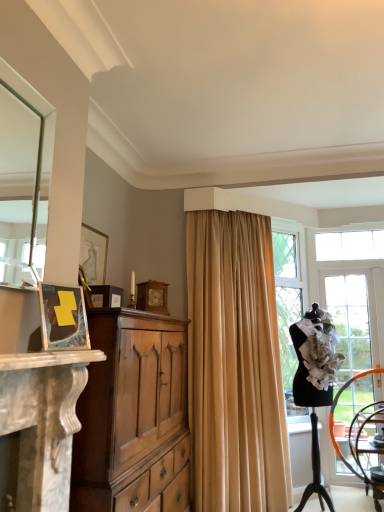
Question: Is black mannequin at right to the left of matte brown picture frame at center-left, the 2th picture frame from the front, from the viewer's perspective?

Choices:
 (A) yes
 (B) no

Answer: (B)

Question: From a real-world perspective, is black mannequin at right under matte brown picture frame at center-left, which is the third picture frame in back-to-front order?

Choices:
 (A) no
 (B) yes

Answer: (B)

Question: Is black mannequin at right far from matte brown picture frame at center-left, which is the third picture frame in back-to-front order?

Choices:
 (A) yes
 (B) no

Answer: (A)

Question: Does black mannequin at right appear on the right side of matte brown picture frame at center-left, the 2th picture frame from the front?

Choices:
 (A) yes
 (B) no

Answer: (A)

Question: Does black mannequin at right have a greater height compared to matte brown picture frame at center-left, which is the third picture frame in back-to-front order?

Choices:
 (A) no
 (B) yes

Answer: (B)

Question: Can you confirm if black mannequin at right is smaller than matte brown picture frame at center-left, which is the third picture frame in back-to-front order?

Choices:
 (A) no
 (B) yes

Answer: (A)

Question: Does wooden clock at center, positioned as the first picture frame in back-to-front order, contain light brown wood cabinet at left?

Choices:
 (A) no
 (B) yes

Answer: (A)

Question: From the image's perspective, is wooden clock at center, positioned as the first picture frame in back-to-front order, located beneath light brown wood cabinet at left?

Choices:
 (A) no
 (B) yes

Answer: (A)

Question: Is wooden clock at center, the 4th picture frame from the front, oriented away from light brown wood cabinet at left?

Choices:
 (A) no
 (B) yes

Answer: (A)

Question: Does wooden clock at center, the 4th picture frame from the front, appear on the left side of light brown wood cabinet at left?

Choices:
 (A) no
 (B) yes

Answer: (A)

Question: Is wooden clock at center, positioned as the first picture frame in back-to-front order, in front of light brown wood cabinet at left?

Choices:
 (A) yes
 (B) no

Answer: (B)

Question: Can you confirm if wooden clock at center, the 4th picture frame from the front, is shorter than light brown wood cabinet at left?

Choices:
 (A) no
 (B) yes

Answer: (B)

Question: Is black mannequin at right next to matte black picture frame at left, the 4th picture frame from the back?

Choices:
 (A) yes
 (B) no

Answer: (B)